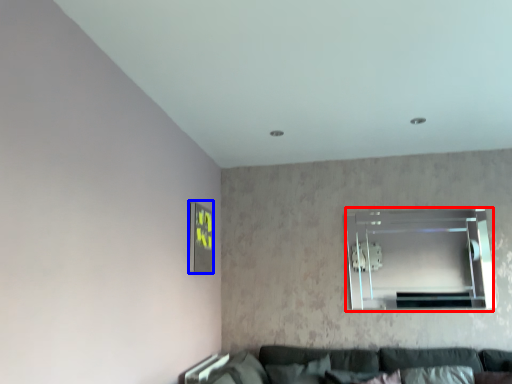
Question: Which of the following is the closest to the observer, window (highlighted by a red box) or picture frame (highlighted by a blue box)?

Choices:
 (A) window
 (B) picture frame

Answer: (B)